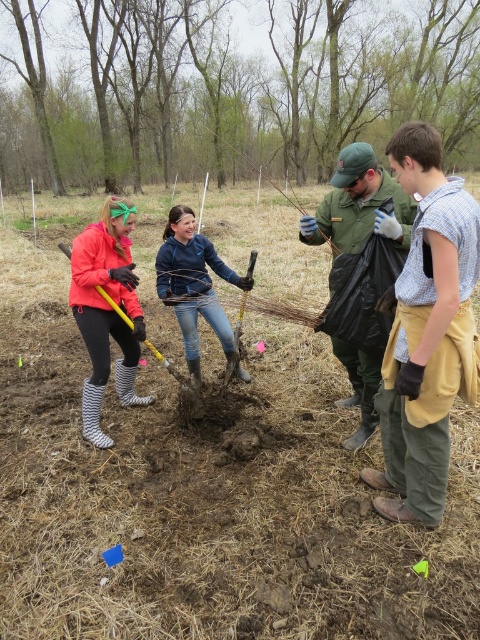
In the scene where people are planting trees, there are two individuals wearing a light blue plaid shirt at center and a green matte jacket at center. From the perspective of someone standing at the front of the group facing towards the trees, which clothing item is positioned to the right?

The light blue plaid shirt at center is to the right of the green matte jacket at center.

You are standing at the origin point in the scene. Which object is located at coordinates point [360,205]?

The point [360,205] corresponds to the green matte jacket at center.